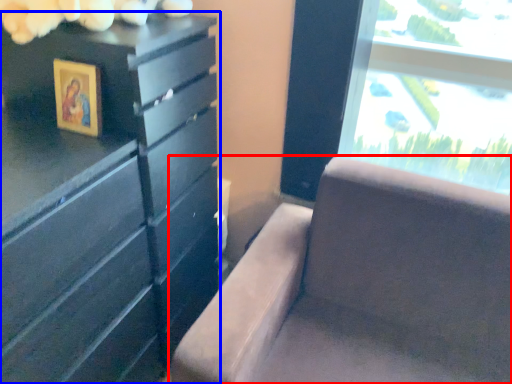
Question: Among these objects, which one is farthest to the camera, furniture (highlighted by a red box) or chest of drawers (highlighted by a blue box)?

Choices:
 (A) furniture
 (B) chest of drawers

Answer: (B)